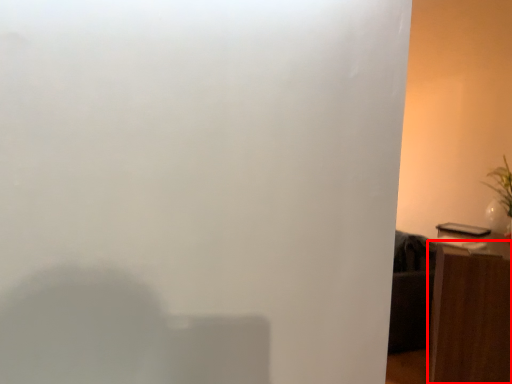
Question: From the image's perspective, where is furniture (annotated by the red box) located in relation to plant in the image?

Choices:
 (A) above
 (B) below

Answer: (B)